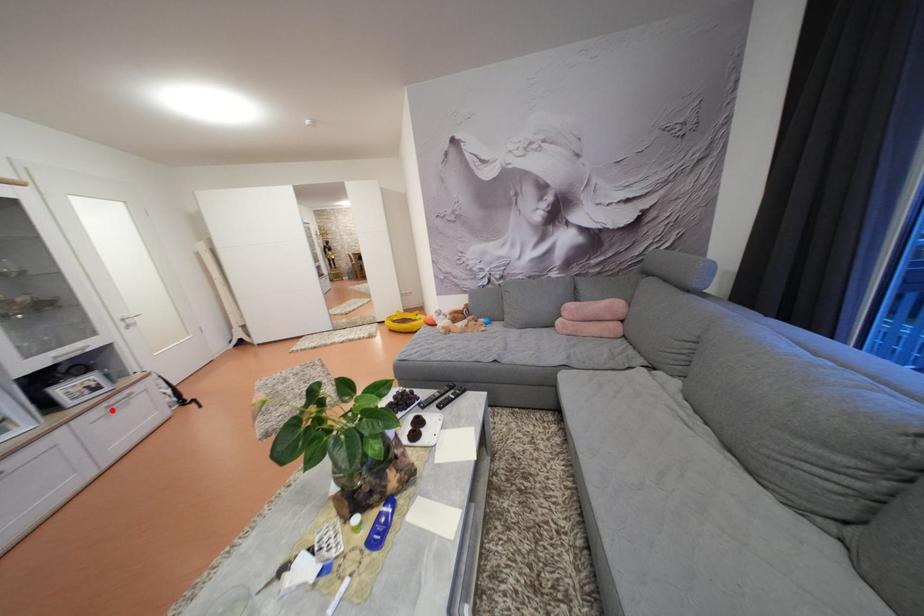
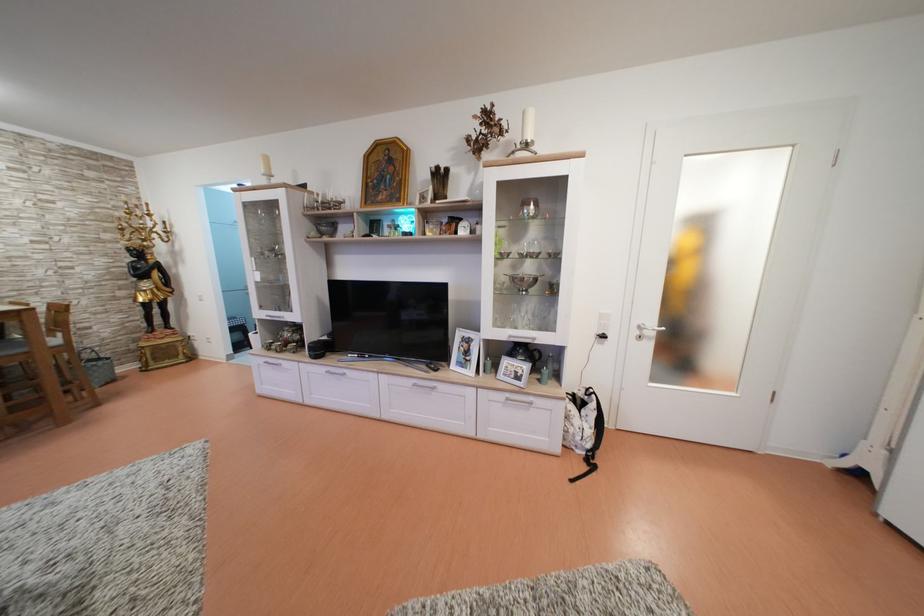
The point at the highlighted location is marked in the first image. Where is the corresponding point in the second image?

(515, 400)